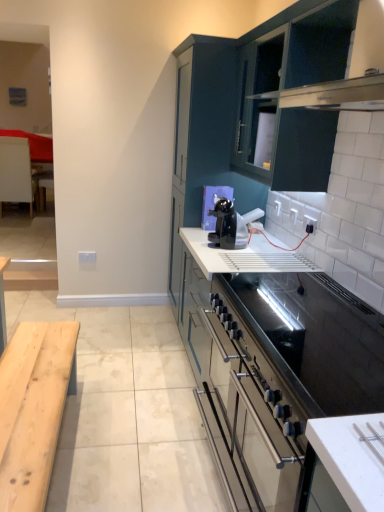
Question: From the image's perspective, is matte dark blue cabinet at upper center, the second cabinetry in the front-to-back sequence, below white plastic electric outlet at center, which is the second electric outlet from front to back?

Choices:
 (A) yes
 (B) no

Answer: (B)

Question: Can you confirm if matte dark blue cabinet at upper center, the second cabinetry in the front-to-back sequence, is shorter than white plastic electric outlet at center, which is the second electric outlet from front to back?

Choices:
 (A) yes
 (B) no

Answer: (B)

Question: Does matte dark blue cabinet at upper center, arranged as the 1th cabinetry when viewed from the back, have a larger size compared to white plastic electric outlet at center, which is the second electric outlet from top to bottom?

Choices:
 (A) no
 (B) yes

Answer: (B)

Question: Does matte dark blue cabinet at upper center, the second cabinetry in the front-to-back sequence, have a greater width compared to white plastic electric outlet at center, which is the second electric outlet in right-to-left order?

Choices:
 (A) yes
 (B) no

Answer: (A)

Question: From a real-world perspective, does matte dark blue cabinet at upper center, the second cabinetry in the front-to-back sequence, stand above white plastic electric outlet at center, which is the second electric outlet from top to bottom?

Choices:
 (A) no
 (B) yes

Answer: (B)

Question: Does matte dark blue cabinet at upper center, the second cabinetry in the front-to-back sequence, turn towards white plastic electric outlet at center, which is the second electric outlet from front to back?

Choices:
 (A) yes
 (B) no

Answer: (A)

Question: Is white wood table at left aimed at dark teal cabinet at upper center, marked as the 2th cabinetry in a back-to-front arrangement?

Choices:
 (A) no
 (B) yes

Answer: (A)

Question: Are white wood table at left and dark teal cabinet at upper center, marked as the 2th cabinetry in a back-to-front arrangement, beside each other?

Choices:
 (A) no
 (B) yes

Answer: (A)

Question: Does white wood table at left have a greater width compared to dark teal cabinet at upper center, marked as the 2th cabinetry in a back-to-front arrangement?

Choices:
 (A) yes
 (B) no

Answer: (A)

Question: Is white wood table at left bigger than dark teal cabinet at upper center, marked as the 2th cabinetry in a back-to-front arrangement?

Choices:
 (A) no
 (B) yes

Answer: (A)

Question: Is white wood table at left taller than dark teal cabinet at upper center, marked as the 2th cabinetry in a back-to-front arrangement?

Choices:
 (A) yes
 (B) no

Answer: (A)

Question: Can you confirm if white wood table at left is positioned to the left of dark teal cabinet at upper center, marked as the 2th cabinetry in a back-to-front arrangement?

Choices:
 (A) yes
 (B) no

Answer: (A)

Question: Does white glossy electric outlet at upper right, the 1th electric outlet viewed from the front, appear on the right side of black glossy coffee machine at center?

Choices:
 (A) yes
 (B) no

Answer: (A)